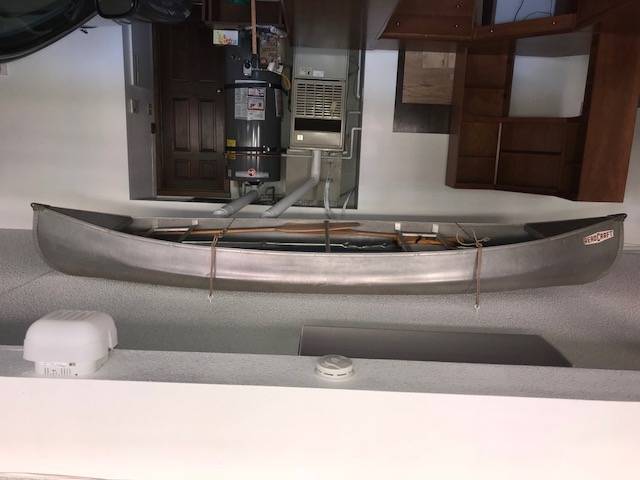
Find the location of a particular element. ceiling is located at coordinates (608, 330).